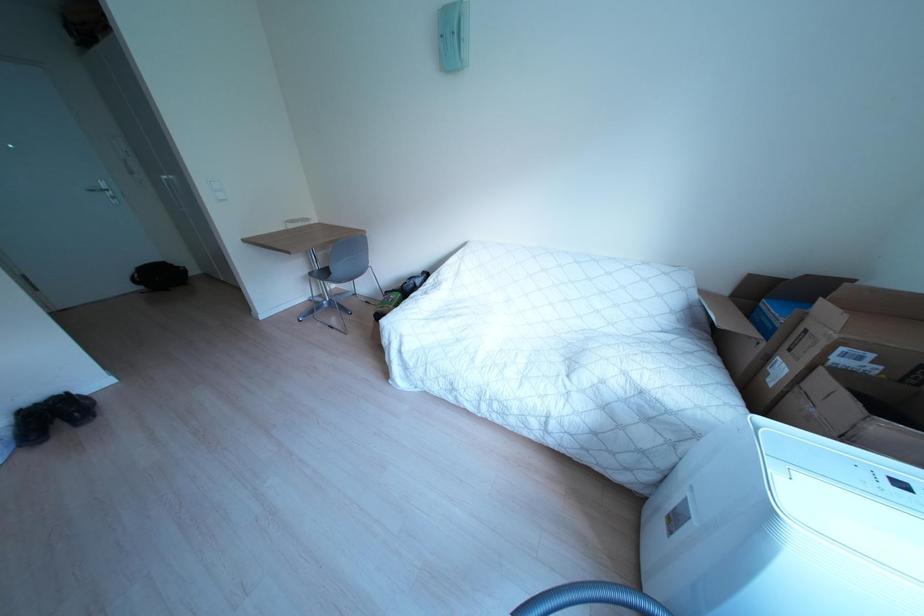
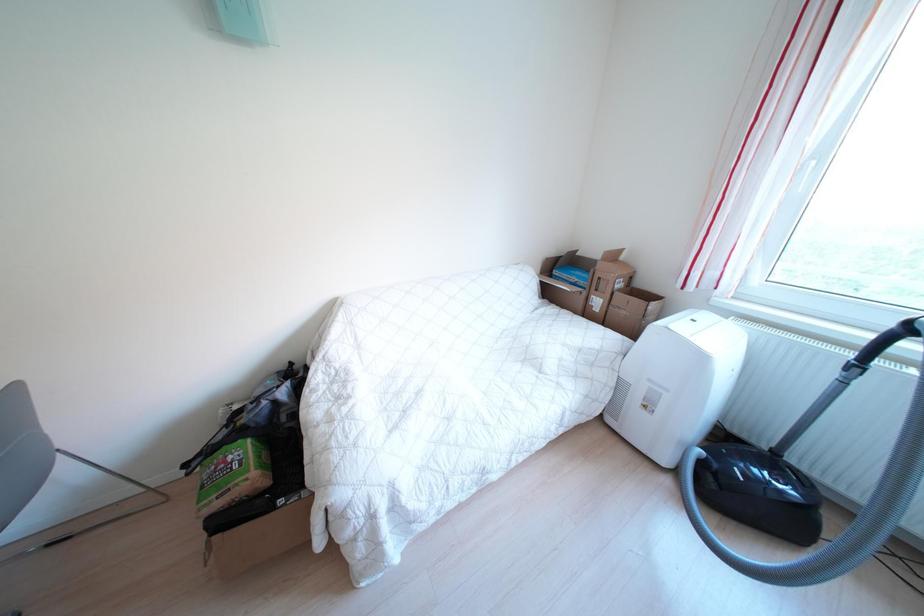
Question: Based on the continuous images, in which direction is the camera rotating? Reply with the corresponding letter.

Choices:
 (A) Left
 (B) Right
 (C) Up
 (D) Down

Answer: (B)